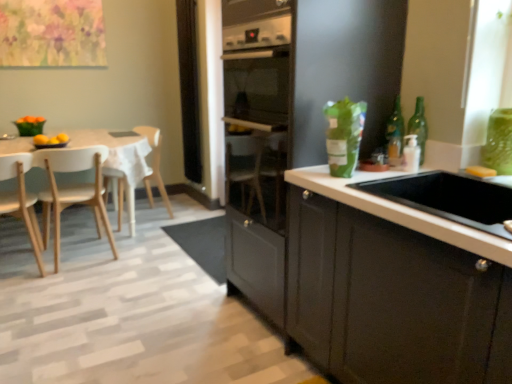
What is the approximate width of green glass bottle at upper right, placed as the 2th bottle when sorted from right to left?

It is 2.52 inches.

The image size is (512, 384). Describe the element at coordinates (21, 200) in the screenshot. I see `light wood chair at left, arranged as the 1th chair when viewed from the front` at that location.

Describe the element at coordinates (119, 161) in the screenshot. This screenshot has width=512, height=384. I see `white wood table at left` at that location.

This screenshot has width=512, height=384. Describe the element at coordinates (399, 211) in the screenshot. I see `white glossy sink at center right` at that location.

The width and height of the screenshot is (512, 384). In order to click on light wood chair at left, acting as the 2th chair starting from the back in this screenshot , I will do `click(72, 190)`.

I want to click on green glass bottle at upper right, the 2th bottle viewed from the left, so click(x=419, y=126).

Image resolution: width=512 pixels, height=384 pixels. What are the coordinates of `green glass bottle at upper right, positioned as the 1th bottle in left-to-right order` in the screenshot? It's located at (395, 135).

From the image's perspective, which is below, green glass bottle at upper right, the 2th bottle viewed from the left, or light wood chair at left, arranged as the 1th chair when viewed from the front?

light wood chair at left, arranged as the 1th chair when viewed from the front.

In terms of width, does green glass bottle at upper right, which appears as the 1th bottle when viewed from the right, look wider or thinner when compared to light wood chair at left, arranged as the 1th chair when viewed from the front?

Clearly, green glass bottle at upper right, which appears as the 1th bottle when viewed from the right, has less width compared to light wood chair at left, arranged as the 1th chair when viewed from the front.

Is green glass bottle at upper right, which appears as the 1th bottle when viewed from the right, outside of light wood chair at left, arranged as the 1th chair when viewed from the front?

A: Yes, green glass bottle at upper right, which appears as the 1th bottle when viewed from the right, is not within light wood chair at left, arranged as the 1th chair when viewed from the front.

Consider the image. Which is more to the right, green glass bottle at upper right, the 2th bottle viewed from the left, or light wood chair at left, which is the third chair in back-to-front order?

green glass bottle at upper right, the 2th bottle viewed from the left, is more to the right.

Would you consider black mesh screen at center to be distant from green glass bottle at upper right, which appears as the 1th bottle when viewed from the right?

That's right, there is a large distance between black mesh screen at center and green glass bottle at upper right, which appears as the 1th bottle when viewed from the right.

From a real-world perspective, which object rests below the other?

green glass bottle at upper right, which appears as the 1th bottle when viewed from the right, is physically lower.

Is black mesh screen at center to the left or to the right of green glass bottle at upper right, which appears as the 1th bottle when viewed from the right, in the image?

black mesh screen at center is to the left of green glass bottle at upper right, which appears as the 1th bottle when viewed from the right.

Is black mesh screen at center looking in the opposite direction of green glass bottle at upper right, the 2th bottle viewed from the left?

No.

Between green glass bottle at upper right, positioned as the 1th bottle in left-to-right order, and green glass bottle at upper right, the 2th bottle viewed from the left, which one appears on the left side from the viewer's perspective?

green glass bottle at upper right, positioned as the 1th bottle in left-to-right order, is more to the left.

Which is behind, point (401, 131) or point (411, 125)?

The point (401, 131) is farther from the camera.

Is green glass bottle at upper right, positioned as the 1th bottle in left-to-right order, next to green glass bottle at upper right, which appears as the 1th bottle when viewed from the right?

Yes, green glass bottle at upper right, positioned as the 1th bottle in left-to-right order, is next to green glass bottle at upper right, which appears as the 1th bottle when viewed from the right.

Can you confirm if green glass bottle at upper right, positioned as the 1th bottle in left-to-right order, is thinner than green glass bottle at upper right, which appears as the 1th bottle when viewed from the right?

No, green glass bottle at upper right, positioned as the 1th bottle in left-to-right order, is not thinner than green glass bottle at upper right, which appears as the 1th bottle when viewed from the right.

From a real-world perspective, is white glossy sink at center right physically located above or below white wood table at left?

Clearly, from a real-world perspective, white glossy sink at center right is above white wood table at left.

Can white wood table at left be found inside white glossy sink at center right?

No.

Considering the sizes of objects white glossy sink at center right and white wood table at left in the image provided, who is wider, white glossy sink at center right or white wood table at left?

With larger width is white wood table at left.

From the image's perspective, does white glossy sink at center right appear higher than white wood table at left?

No, from the image's perspective, white glossy sink at center right is not over white wood table at left.

From a real-world perspective, is green glass bottle at upper right, the 2th bottle viewed from the left, over wooden chair at left, the 3th chair viewed from the front?

Correct, in the physical world, green glass bottle at upper right, the 2th bottle viewed from the left, is higher than wooden chair at left, the 3th chair viewed from the front.

Between green glass bottle at upper right, which appears as the 1th bottle when viewed from the right, and wooden chair at left, the 1th chair from the back, which one has larger width?

Wider between the two is wooden chair at left, the 1th chair from the back.

Is green glass bottle at upper right, the 2th bottle viewed from the left, placed right next to wooden chair at left, the 1th chair from the back?

green glass bottle at upper right, the 2th bottle viewed from the left, and wooden chair at left, the 1th chair from the back, are not in contact.

Does green glass bottle at upper right, which appears as the 1th bottle when viewed from the right, have a lesser height compared to wooden chair at left, the 1th chair from the back?

Correct, green glass bottle at upper right, which appears as the 1th bottle when viewed from the right, is not as tall as wooden chair at left, the 1th chair from the back.

Can white wood table at left be found inside green glass bottle at upper right, which appears as the 1th bottle when viewed from the right?

No, white wood table at left is located outside of green glass bottle at upper right, which appears as the 1th bottle when viewed from the right.

Locate an element on the screen. Image resolution: width=512 pixels, height=384 pixels. kitchen & dining room table below the green glass bottle at upper right, the 2th bottle viewed from the left (from the image's perspective) is located at coordinates (119, 161).

Looking at this image, considering the sizes of green glass bottle at upper right, which appears as the 1th bottle when viewed from the right, and white wood table at left in the image, is green glass bottle at upper right, which appears as the 1th bottle when viewed from the right, taller or shorter than white wood table at left?

Considering their sizes, green glass bottle at upper right, which appears as the 1th bottle when viewed from the right, has less height than white wood table at left.

Is point (422, 121) positioned before point (116, 156)?

Yes, point (422, 121) is in front of point (116, 156).

Is white glossy sink at center right a part of white wood table at left?

No, white glossy sink at center right is not surrounded by white wood table at left.

Is the position of white wood table at left more distant than that of white glossy sink at center right?

Yes, white wood table at left is behind white glossy sink at center right.

Considering the relative sizes of white wood table at left and white glossy sink at center right in the image provided, is white wood table at left smaller than white glossy sink at center right?

No.

Starting from the green glass bottle at upper right, the 2th bottle viewed from the left, which chair is the 1st one behind? Please provide its 2D coordinates.

[(21, 200)]

Where is `window screen that is on the left side of green glass bottle at upper right, which appears as the 1th bottle when viewed from the right`? window screen that is on the left side of green glass bottle at upper right, which appears as the 1th bottle when viewed from the right is located at coordinates (189, 89).

Estimate the real-world distances between objects in this image. Which object is further from white glossy sink at center right, light wood chair at left, which is the third chair in back-to-front order, or green glass bottle at upper right, the 2th bottle viewed from the left?

light wood chair at left, which is the third chair in back-to-front order.

Which object lies further to the anchor point white glossy sink at center right, light wood chair at left, which is the third chair in back-to-front order, or green glass bottle at upper right, placed as the 2th bottle when sorted from right to left?

light wood chair at left, which is the third chair in back-to-front order, is positioned further to the anchor white glossy sink at center right.

Which object lies further to the anchor point wooden chair at left, the 3th chair viewed from the front, white wood table at left or white glossy sink at center right?

white glossy sink at center right.

Based on their spatial positions, is white glossy sink at center right or light wood chair at left, the 2th chair viewed from the front, closer to white wood table at left?

The object closer to white wood table at left is light wood chair at left, the 2th chair viewed from the front.

Considering their positions, is light wood chair at left, which is the third chair in back-to-front order, positioned closer to white wood table at left than wooden chair at left, the 3th chair viewed from the front?

Based on the image, wooden chair at left, the 3th chair viewed from the front, appears to be nearer to white wood table at left.

Considering their positions, is white glossy sink at center right positioned closer to black mesh screen at center than light wood chair at left, which is the third chair in back-to-front order?

light wood chair at left, which is the third chair in back-to-front order.

From the image, which object appears to be farther from black mesh screen at center, white wood table at left or white glossy sink at center right?

white glossy sink at center right lies further to black mesh screen at center than the other object.

When comparing their distances from light wood chair at left, which is the third chair in back-to-front order, does white wood table at left or green glass bottle at upper right, the 2th bottle viewed from the left, seem closer?

white wood table at left lies closer to light wood chair at left, which is the third chair in back-to-front order, than the other object.

This screenshot has width=512, height=384. Find the location of `window screen between light wood chair at left, arranged as the 1th chair when viewed from the front, and green glass bottle at upper right, positioned as the 1th bottle in left-to-right order, from left to right`. window screen between light wood chair at left, arranged as the 1th chair when viewed from the front, and green glass bottle at upper right, positioned as the 1th bottle in left-to-right order, from left to right is located at coordinates (189, 89).

Find the location of a particular element. kitchen & dining room table located between light wood chair at left, which is the third chair in back-to-front order, and light wood chair at left, acting as the 2th chair starting from the back, in the left-right direction is located at coordinates (119, 161).

You are a GUI agent. You are given a task and a screenshot of the screen. Output one action in this format:
    pyautogui.click(x=<x>, y=<y>)
    Task: Click on the window screen situated between light wood chair at left, the 2th chair viewed from the front, and green glass bottle at upper right, positioned as the 1th bottle in left-to-right order, from left to right
    
    Given the screenshot: What is the action you would take?
    pos(189,89)

You are a GUI agent. You are given a task and a screenshot of the screen. Output one action in this format:
    pyautogui.click(x=<x>, y=<y>)
    Task: Click on the bottle between white glossy sink at center right and green glass bottle at upper right, positioned as the 1th bottle in left-to-right order, from front to back
    
    Given the screenshot: What is the action you would take?
    pyautogui.click(x=419, y=126)